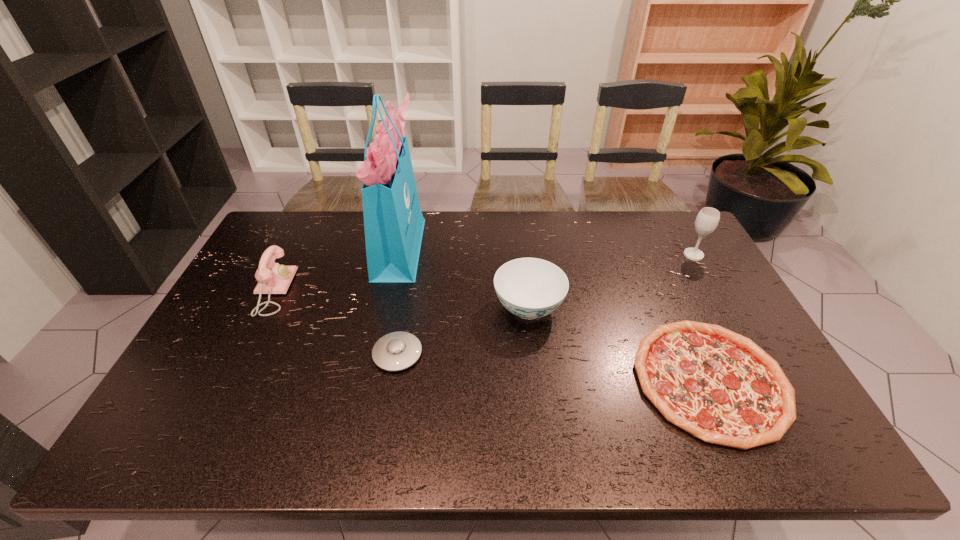
In order to click on the tallest object in this screenshot , I will do `click(393, 221)`.

Locate an element on the screen. wineglass is located at coordinates (708, 218).

The height and width of the screenshot is (540, 960). Identify the location of the leftmost object. (272, 278).

Identify the location of chinaware. (530, 288).

Identify the location of saucer. (396, 351).

Find the location of a particular element. The height and width of the screenshot is (540, 960). pizza is located at coordinates (721, 387).

You are a GUI agent. You are given a task and a screenshot of the screen. Output one action in this format:
    pyautogui.click(x=<x>, y=<y>)
    Task: Click on the vacant space located on the right of the tallest object
    The image size is (960, 540).
    Given the screenshot: What is the action you would take?
    pyautogui.click(x=456, y=246)

The width and height of the screenshot is (960, 540). I want to click on free spot located on the front of the second tallest object, so click(747, 349).

You are a GUI agent. You are given a task and a screenshot of the screen. Output one action in this format:
    pyautogui.click(x=<x>, y=<y>)
    Task: Click on the free point located 0.330m on the dial of the telephone
    
    Given the screenshot: What is the action you would take?
    pyautogui.click(x=396, y=291)

Where is `free space located 0.140m on the front of the chinaware`? This screenshot has width=960, height=540. free space located 0.140m on the front of the chinaware is located at coordinates (537, 377).